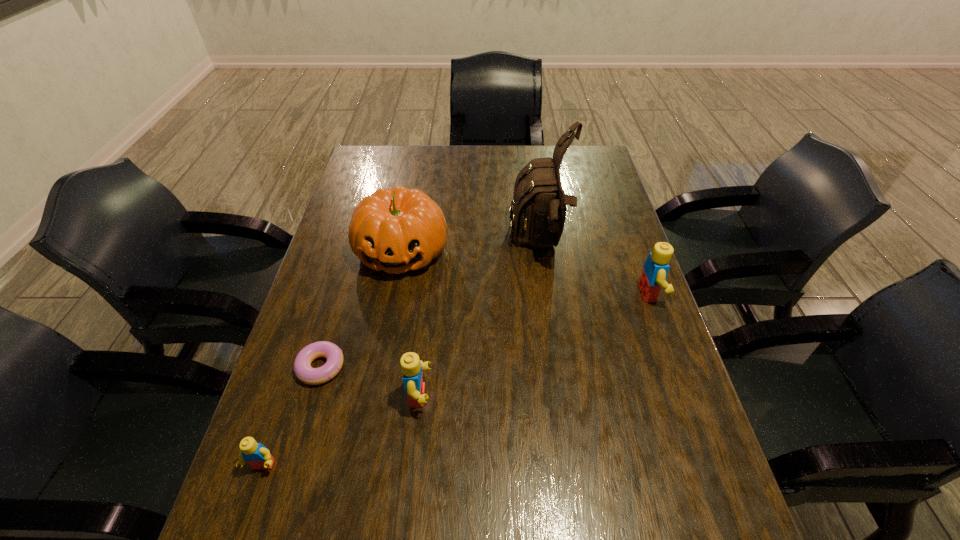
Where is `spot to insert another Lego for uniform distribution`? This screenshot has height=540, width=960. spot to insert another Lego for uniform distribution is located at coordinates (546, 340).